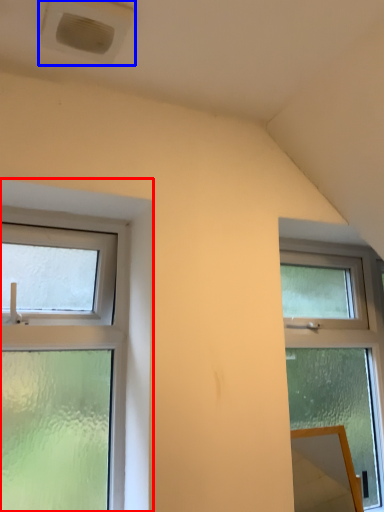
Question: Among these objects, which one is farthest to the camera, window (highlighted by a red box) or air conditioning (highlighted by a blue box)?

Choices:
 (A) window
 (B) air conditioning

Answer: (A)